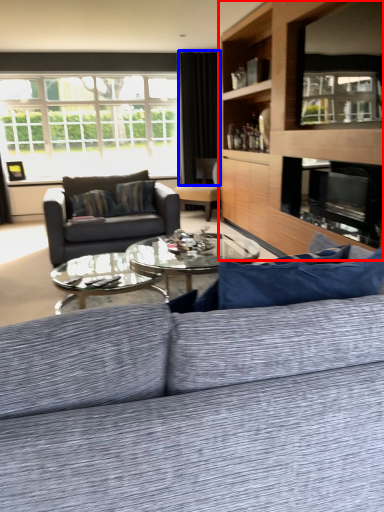
Question: Which of the following is the farthest to the observer, entertainment center (highlighted by a red box) or curtain (highlighted by a blue box)?

Choices:
 (A) entertainment center
 (B) curtain

Answer: (B)